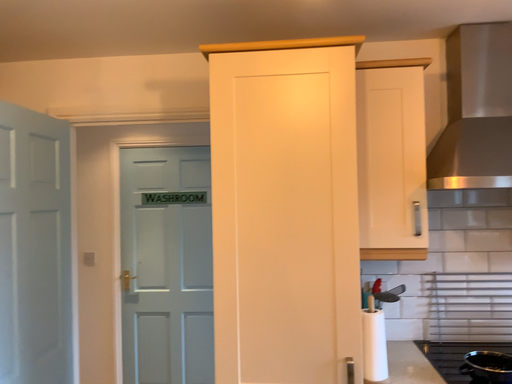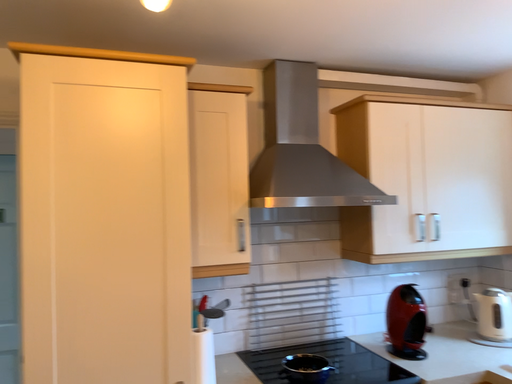
Question: Which way did the camera rotate in the video?

Choices:
 (A) rotated right
 (B) rotated left

Answer: (A)